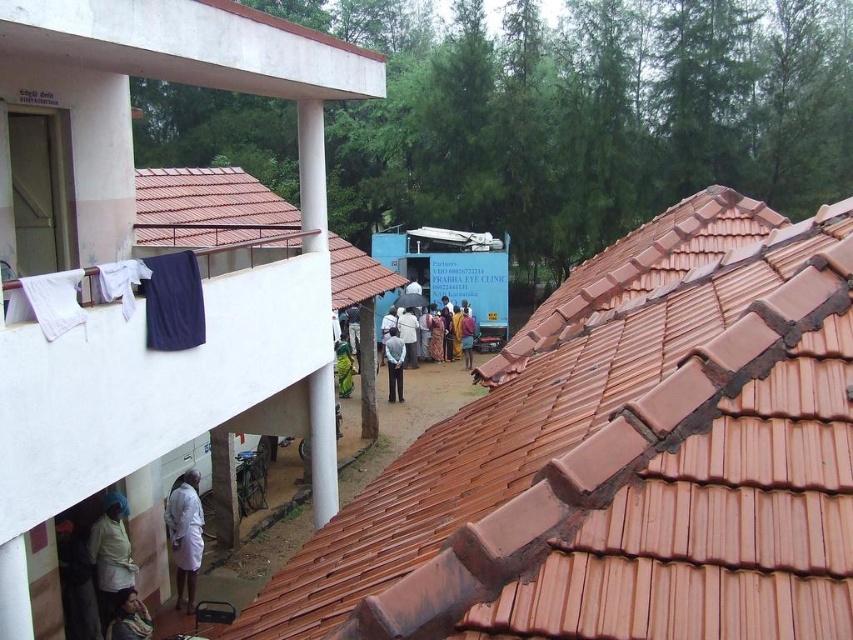
Question: Which of the following is the closest to the observer?

Choices:
 (A) (142, 29)
 (B) (466, 323)
 (C) (170, 275)

Answer: (A)

Question: Estimate the real-world distances between objects in this image. Which object is farther from the dark blue fabric at center?

Choices:
 (A) terracotta clay tiles at upper center
 (B) white cloth at lower left
 (C) light brown fabric at lower left

Answer: (A)

Question: Which object is the closest to the white fabric at left?

Choices:
 (A) white smooth roof at upper left
 (B) white cotton dress at lower left

Answer: (A)

Question: From the image, what is the correct spatial relationship of dark blue fabric at upper left in relation to light blue fabric at center?

Choices:
 (A) above
 (B) below

Answer: (A)

Question: Observing the image, what is the correct spatial positioning of terracotta clay tiles at upper center in reference to dark blue fabric at center?

Choices:
 (A) below
 (B) above

Answer: (A)

Question: Does dark blue fabric at upper left come in front of white cloth at lower left?

Choices:
 (A) yes
 (B) no

Answer: (A)